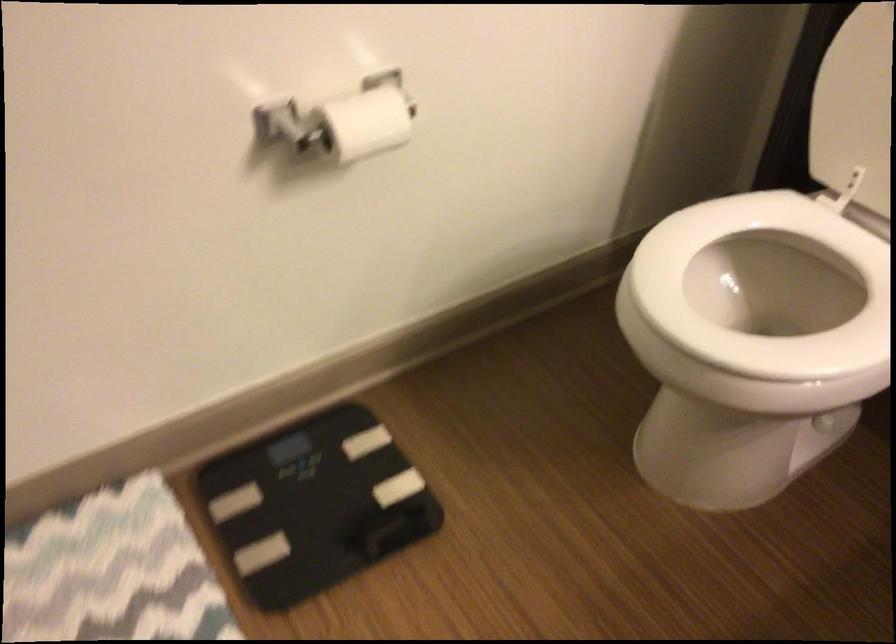
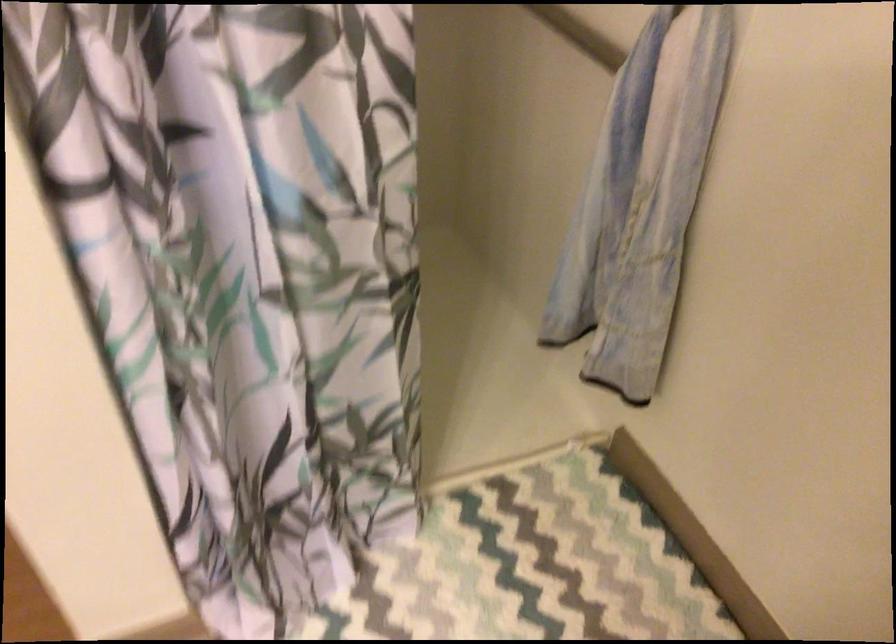
Based on the continuous images, in which direction is the camera rotating?

The rotation direction of the camera is left-down.